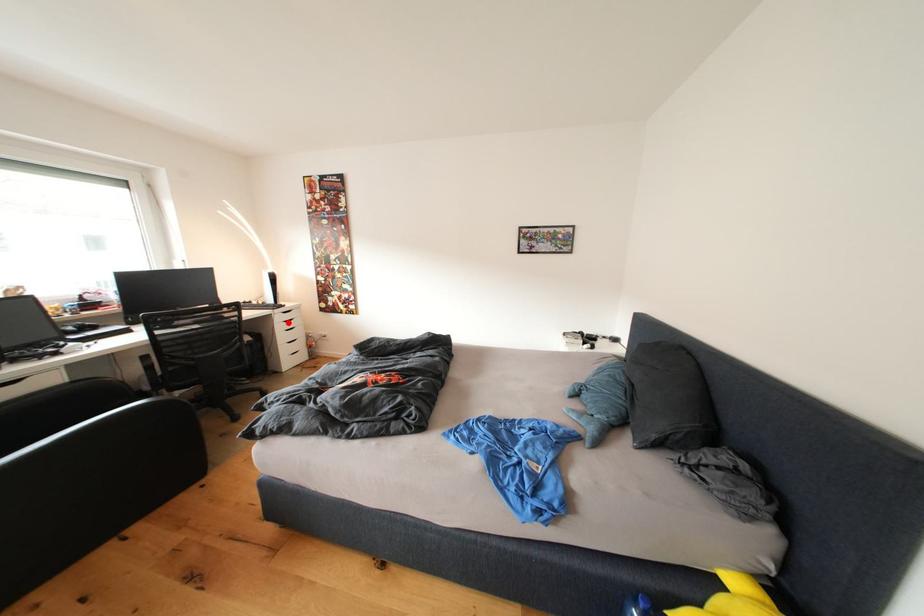
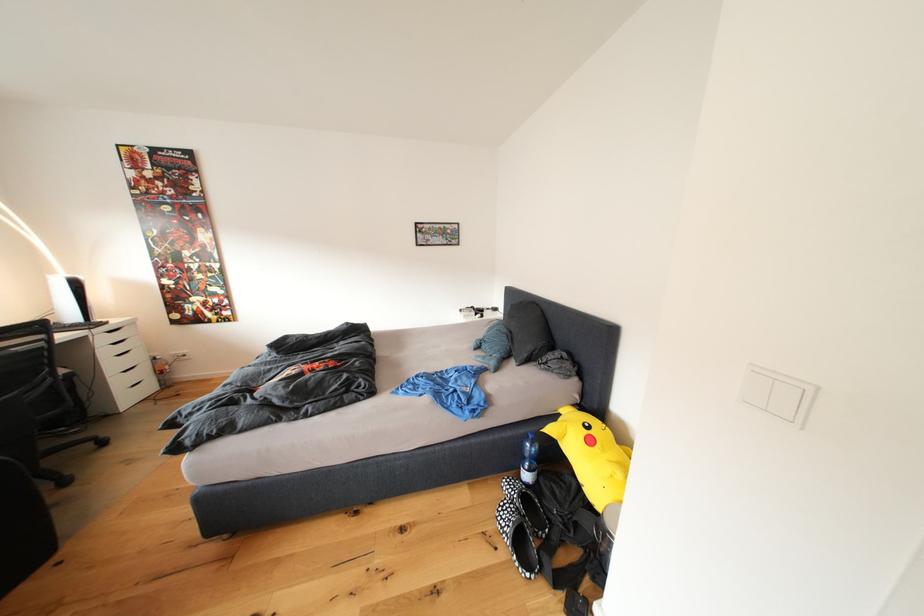
In the second image, find the point that corresponds to the highlighted location in the first image.

(111, 344)